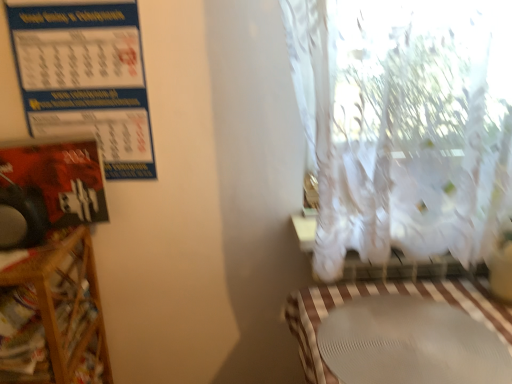
Question: Does white matte table at lower right have a greater width compared to wooden shelf at left?

Choices:
 (A) no
 (B) yes

Answer: (B)

Question: Can wooden shelf at left be found inside white matte table at lower right?

Choices:
 (A) no
 (B) yes

Answer: (A)

Question: Is white matte table at lower right facing towards wooden shelf at left?

Choices:
 (A) yes
 (B) no

Answer: (B)

Question: Would you say white matte table at lower right is outside wooden shelf at left?

Choices:
 (A) no
 (B) yes

Answer: (B)

Question: From the image's perspective, would you say white matte table at lower right is shown under wooden shelf at left?

Choices:
 (A) yes
 (B) no

Answer: (B)

Question: From a real-world perspective, is white matte table at lower right located higher than wooden shelf at left?

Choices:
 (A) yes
 (B) no

Answer: (A)

Question: Could you tell me if wooden shelf at left is turned towards blue paper calendar at upper left?

Choices:
 (A) no
 (B) yes

Answer: (A)

Question: Considering the relative sizes of wooden shelf at left and blue paper calendar at upper left in the image provided, is wooden shelf at left bigger than blue paper calendar at upper left?

Choices:
 (A) no
 (B) yes

Answer: (B)

Question: Does wooden shelf at left come in front of blue paper calendar at upper left?

Choices:
 (A) yes
 (B) no

Answer: (A)

Question: From the image's perspective, is wooden shelf at left under blue paper calendar at upper left?

Choices:
 (A) yes
 (B) no

Answer: (A)

Question: Can you confirm if wooden shelf at left is wider than blue paper calendar at upper left?

Choices:
 (A) yes
 (B) no

Answer: (A)

Question: From the image's perspective, is wooden shelf at left above blue paper calendar at upper left?

Choices:
 (A) no
 (B) yes

Answer: (A)

Question: Does wooden shelf at left come in front of white matte table at lower right?

Choices:
 (A) no
 (B) yes

Answer: (A)